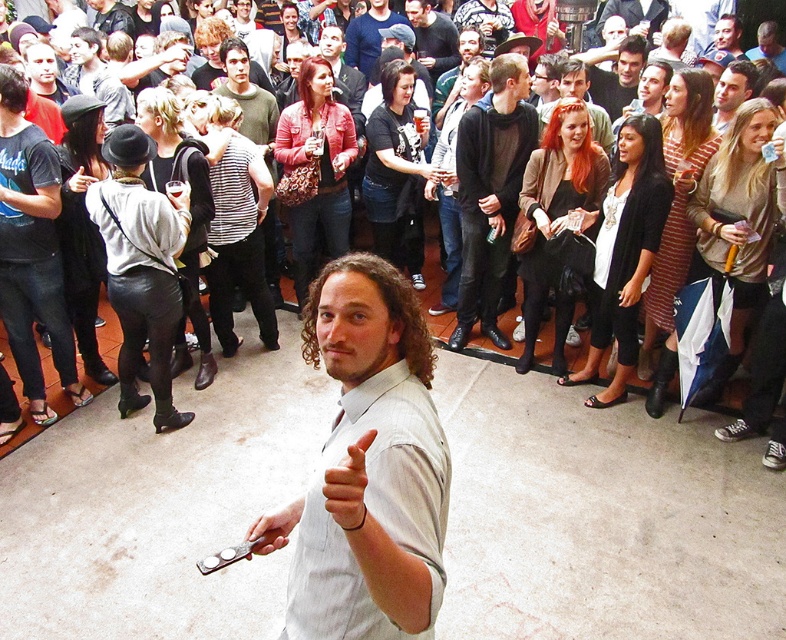
Question: Does leather pants at left have a greater width compared to smooth black shirt at center?

Choices:
 (A) yes
 (B) no

Answer: (A)

Question: Which point appears farthest from the camera in this image?

Choices:
 (A) pos(425,51)
 (B) pos(230,60)
 (C) pos(340,596)
 (D) pos(575,81)

Answer: (A)

Question: Among these objects, which one is nearest to the camera?

Choices:
 (A) smooth black shirt at center
 (B) light gray shirt at center
 (C) dark gray sweater at center
 (D) black leather pants at center

Answer: (B)

Question: Is the position of black leather pants at center more distant than that of striped shirt at center?

Choices:
 (A) no
 (B) yes

Answer: (A)

Question: Does black leather pants at center have a lesser width compared to smooth black shirt at center?

Choices:
 (A) yes
 (B) no

Answer: (B)

Question: Which of the following is the farthest from the observer?

Choices:
 (A) (353, 630)
 (B) (472, 180)
 (C) (17, 209)
 (D) (425, 20)

Answer: (D)